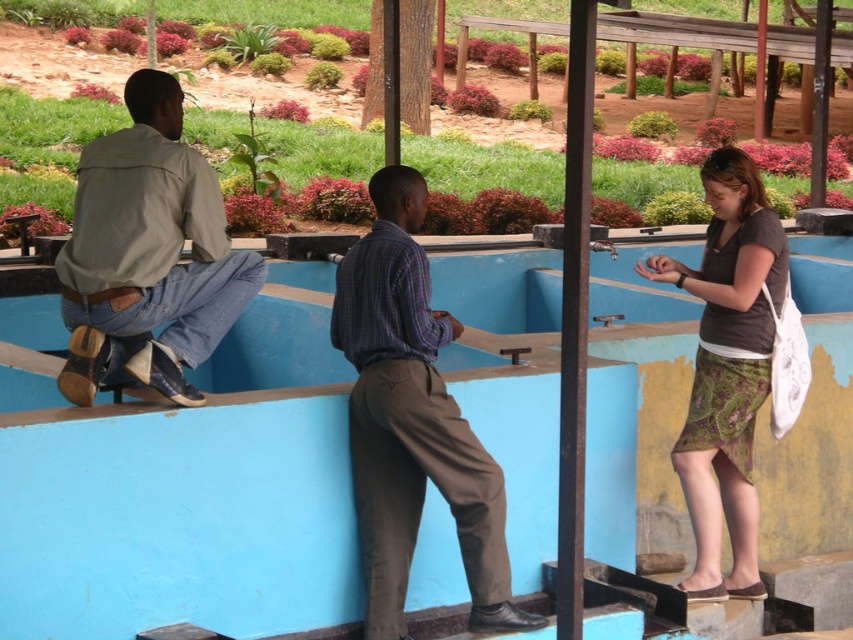
Question: Can you confirm if denim jeans at left is positioned below green textured skirt at right?

Choices:
 (A) no
 (B) yes

Answer: (A)

Question: From the image, what is the correct spatial relationship of plaid shirt at center in relation to denim jeans at left?

Choices:
 (A) above
 (B) below

Answer: (B)

Question: Which object is positioned farthest from the plaid shirt at center?

Choices:
 (A) green textured skirt at right
 (B) denim jeans at left

Answer: (A)

Question: Which object is the farthest from the green textured skirt at right?

Choices:
 (A) plaid shirt at center
 (B) denim jeans at left

Answer: (B)

Question: Can you confirm if denim jeans at left is positioned to the right of green textured skirt at right?

Choices:
 (A) no
 (B) yes

Answer: (A)

Question: Which object is positioned closest to the green textured skirt at right?

Choices:
 (A) denim jeans at left
 (B) plaid shirt at center

Answer: (B)